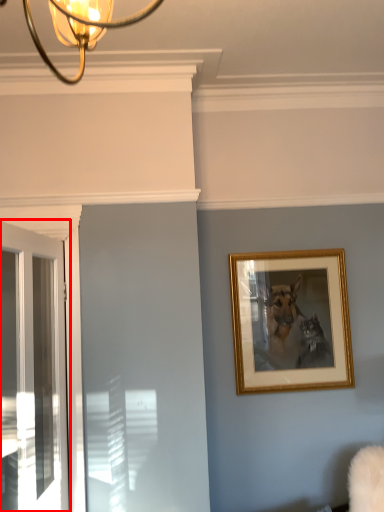
Question: In this image, where is door (annotated by the red box) located relative to picture frame?

Choices:
 (A) left
 (B) right

Answer: (A)